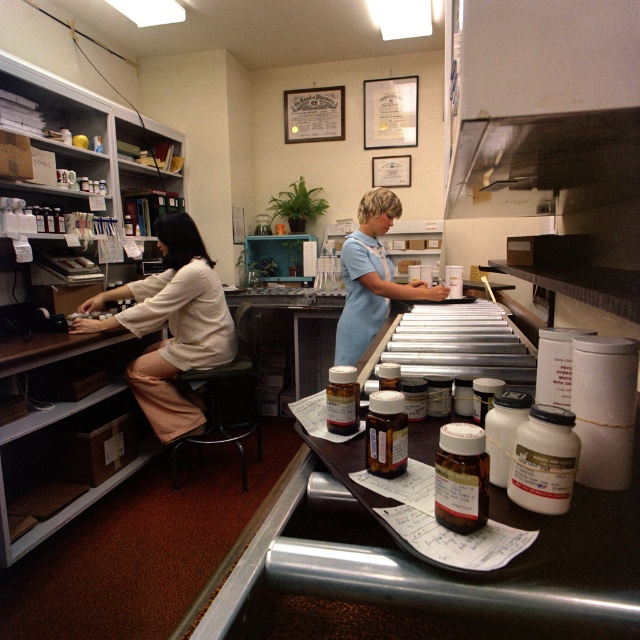
Does matte white blouse at left have a greater width compared to light blue uniform at center?

Indeed, matte white blouse at left has a greater width compared to light blue uniform at center.

Who is taller, matte white blouse at left or light blue uniform at center?

matte white blouse at left

From the picture: Who is more forward, (179, 305) or (355, 323)?

Point (179, 305) is in front.

The height and width of the screenshot is (640, 640). Identify the location of matte white blouse at left. (172, 326).